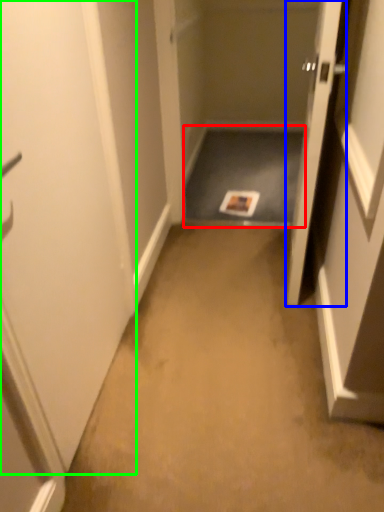
Question: Estimate the real-world distances between objects in this image. Which object is farther from corridor (highlighted by a red box), door (highlighted by a blue box) or door (highlighted by a green box)?

Choices:
 (A) door
 (B) door

Answer: (B)